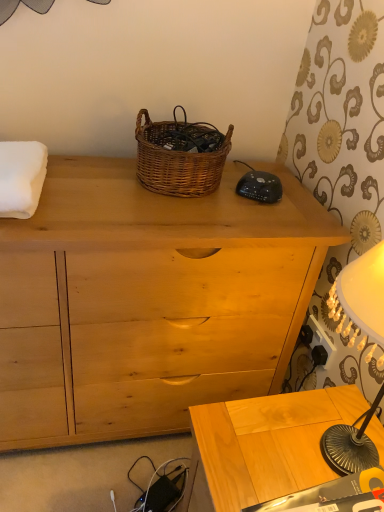
Question: Considering the relative sizes of woven brown picnic basket at center and natural wood chest of drawers at center in the image provided, is woven brown picnic basket at center bigger than natural wood chest of drawers at center?

Choices:
 (A) no
 (B) yes

Answer: (A)

Question: From the image's perspective, is woven brown picnic basket at center located beneath natural wood chest of drawers at center?

Choices:
 (A) yes
 (B) no

Answer: (B)

Question: Does woven brown picnic basket at center lie in front of natural wood chest of drawers at center?

Choices:
 (A) yes
 (B) no

Answer: (B)

Question: Can you confirm if woven brown picnic basket at center is wider than natural wood chest of drawers at center?

Choices:
 (A) yes
 (B) no

Answer: (B)

Question: Is woven brown picnic basket at center shorter than natural wood chest of drawers at center?

Choices:
 (A) no
 (B) yes

Answer: (B)

Question: From the image's perspective, would you say woven brown picnic basket at center is positioned over natural wood chest of drawers at center?

Choices:
 (A) yes
 (B) no

Answer: (A)

Question: Is natural wood chest of drawers at center facing away from black plastic power outlet at lower right?

Choices:
 (A) no
 (B) yes

Answer: (A)

Question: From the image's perspective, does natural wood chest of drawers at center appear lower than black plastic power outlet at lower right?

Choices:
 (A) no
 (B) yes

Answer: (A)

Question: Is natural wood chest of drawers at center thinner than black plastic power outlet at lower right?

Choices:
 (A) yes
 (B) no

Answer: (B)

Question: Is natural wood chest of drawers at center shorter than black plastic power outlet at lower right?

Choices:
 (A) no
 (B) yes

Answer: (A)

Question: Is natural wood chest of drawers at center smaller than black plastic power outlet at lower right?

Choices:
 (A) no
 (B) yes

Answer: (A)

Question: From a real-world perspective, is natural wood chest of drawers at center located beneath black plastic power outlet at lower right?

Choices:
 (A) yes
 (B) no

Answer: (A)

Question: From the image's perspective, does light wood table at lower right appear lower than woven brown picnic basket at center?

Choices:
 (A) no
 (B) yes

Answer: (B)